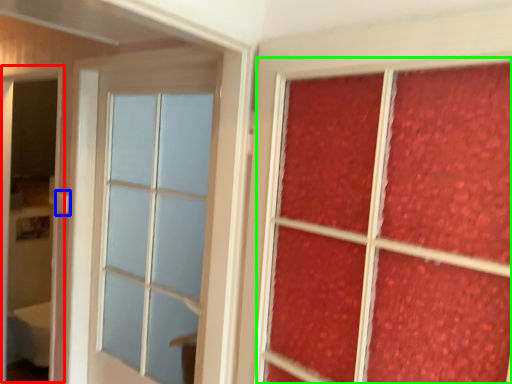
Question: Based on their relative distances, which object is nearer to screen door (highlighted by a red box)? Choose from door handle (highlighted by a blue box) and bay window (highlighted by a green box).

Choices:
 (A) door handle
 (B) bay window

Answer: (A)